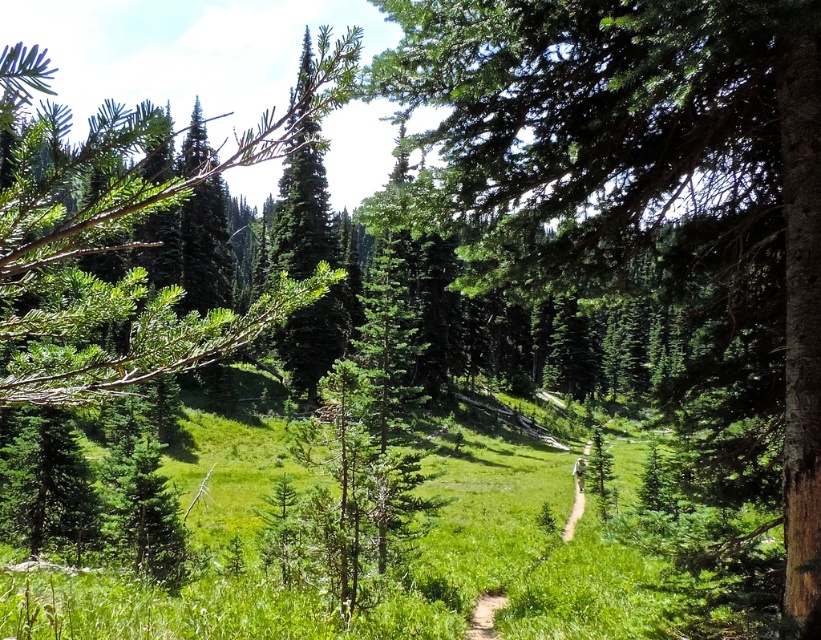
You are standing at the point marked by coordinates point (641,173) in the forest scene. What object is located exactly at that point?

The point (641,173) corresponds to the green textured tree at center.